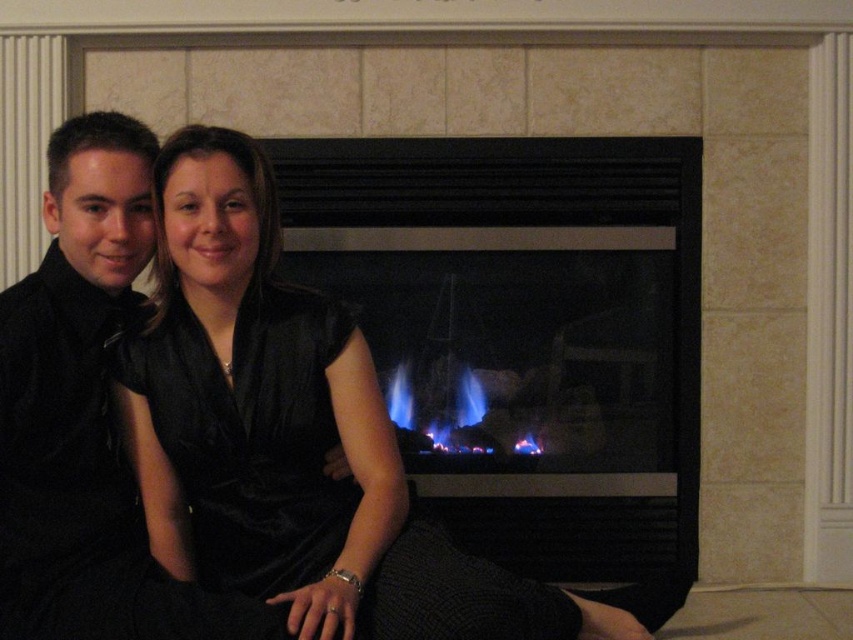
You are standing in front of the fireplace and want to place a decorative item on the exact spot where the black velvet shirt at left is currently located. According to the image, what are the coordinates of that location?

The coordinates of the location where the black velvet shirt at left is positioned are (x=73, y=390).